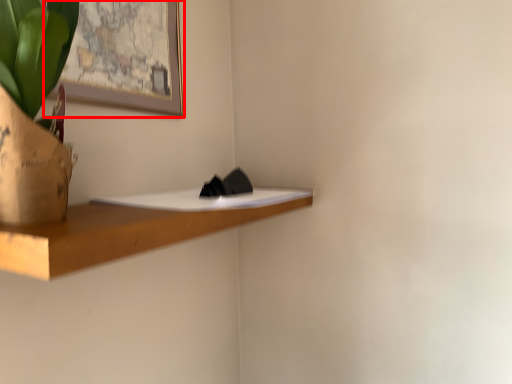
Question: From the image's perspective, what is the correct spatial positioning of picture frame (annotated by the red box) in reference to shelf?

Choices:
 (A) below
 (B) above

Answer: (B)